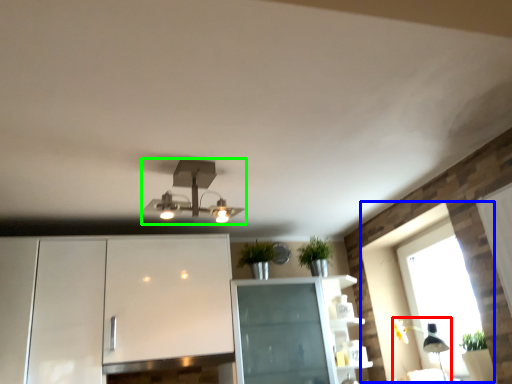
Question: Estimate the real-world distances between objects in this image. Which object is closer to light fixture (highlighted by a red box), window (highlighted by a blue box) or lamp (highlighted by a green box)?

Choices:
 (A) window
 (B) lamp

Answer: (A)